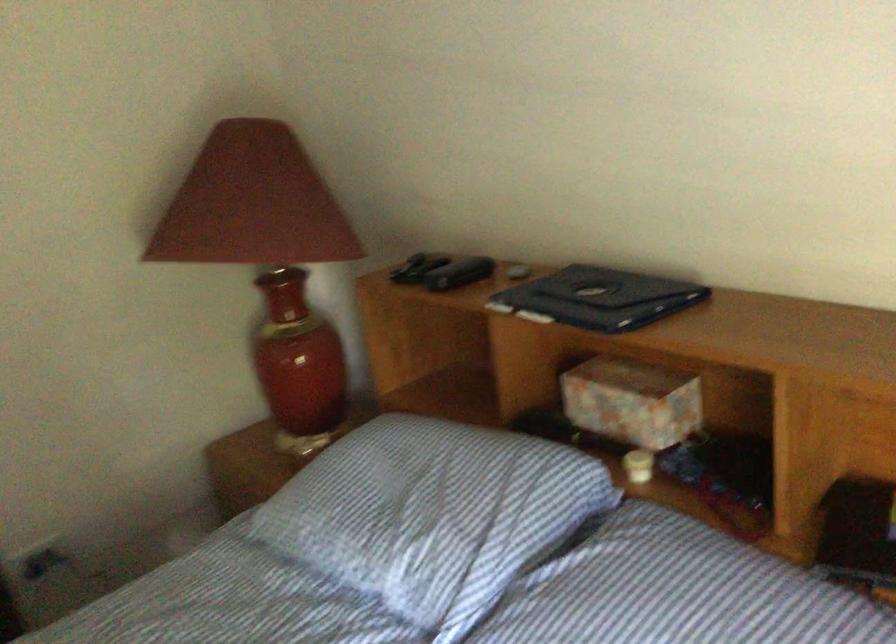
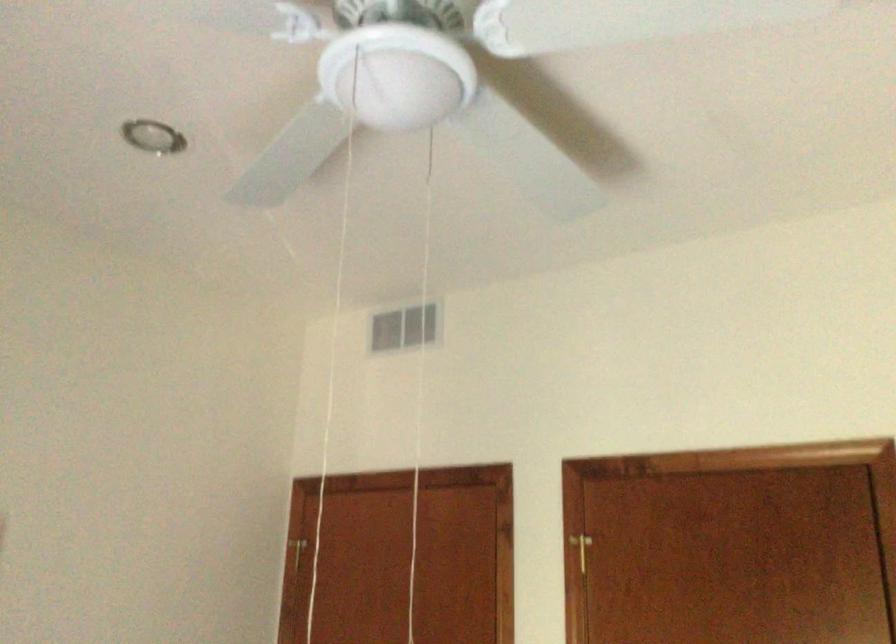
How did the camera likely rotate?

The rotation direction of the camera is left-up.